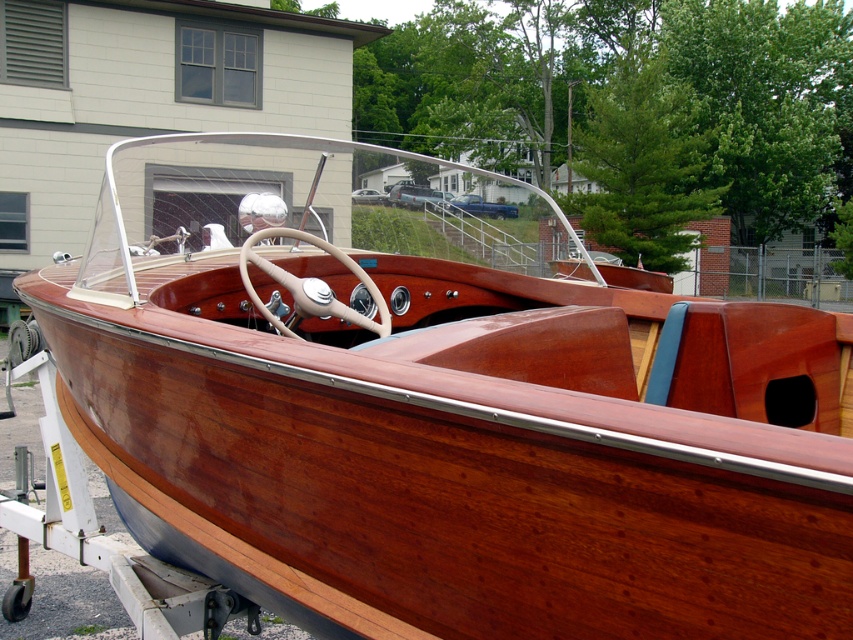
You are a delivery person trying to park your delivery van between the blue metallic truck at center and the metallic silver car at center. According to the scene, which vehicle should you park closer to in order to fit properly?

The blue metallic truck at center is located below the metallic silver car at center. Since the truck is lower, you should park closer to the metallic silver car at center to ensure proper clearance for your van.

You are a delivery driver who needs to park your vehicle in the driveway. You see a blue metallic truck at center and a metallic silver car at center. Which vehicle is blocking the driveway entrance?

The blue metallic truck at center is blocking the driveway entrance because it is in front of the metallic silver car at center, which means it is closer to the entrance.

You are a delivery driver who needs to park your vehicle in a space that can only accommodate vehicles up to 2.5 meters in width. You see a blue metallic truck at center and a metallic silver car at center in the image. Can you determine which vehicle will fit in the parking space?

The blue metallic truck at center might be wider than metallic silver car at center. Since the parking space can only accommodate up to 2.5 meters, it is uncertain if the truck will fit, but the car is likely to fit within the width limit.